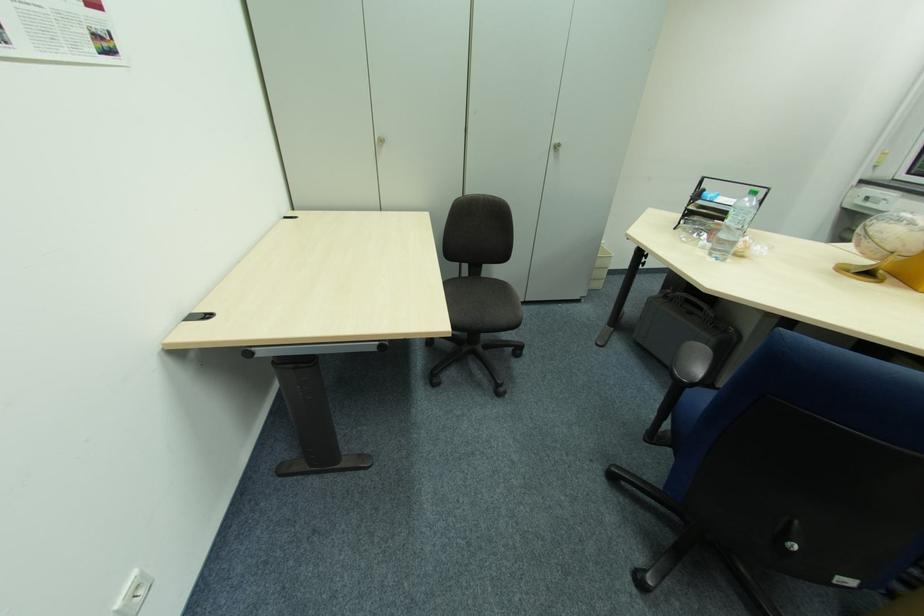
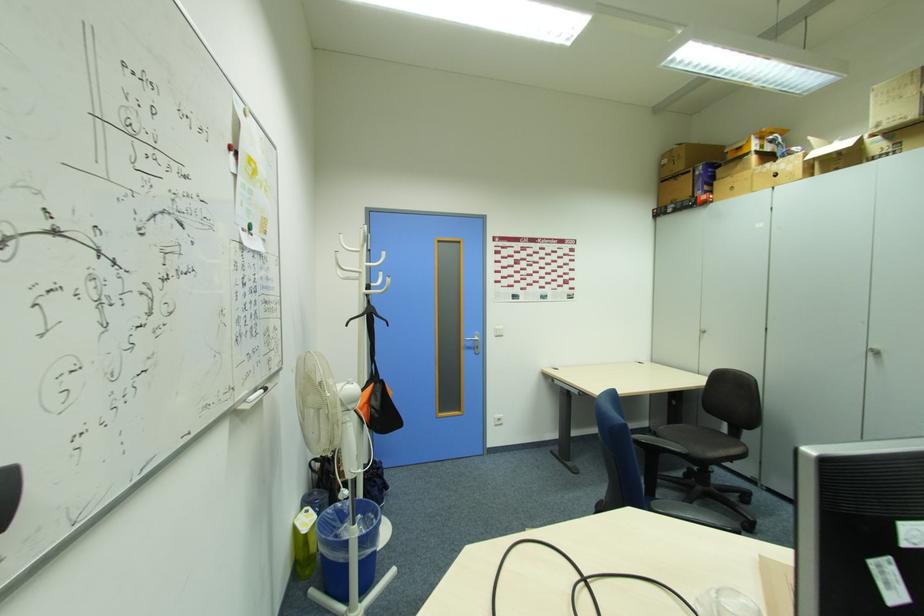
The point at (x=561, y=148) is marked in the first image. Where is the corresponding point in the second image?

(880, 354)